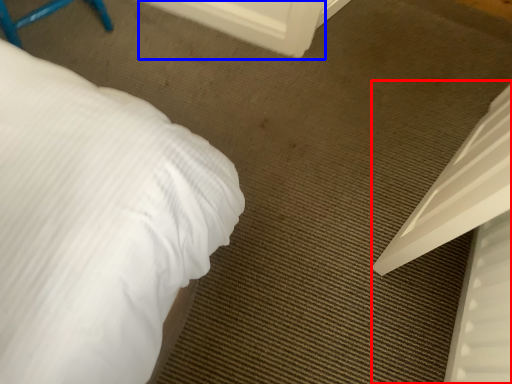
Question: Which point is closer to the camera, bed (highlighted by a red box) or screen door (highlighted by a blue box)?

Choices:
 (A) bed
 (B) screen door

Answer: (A)